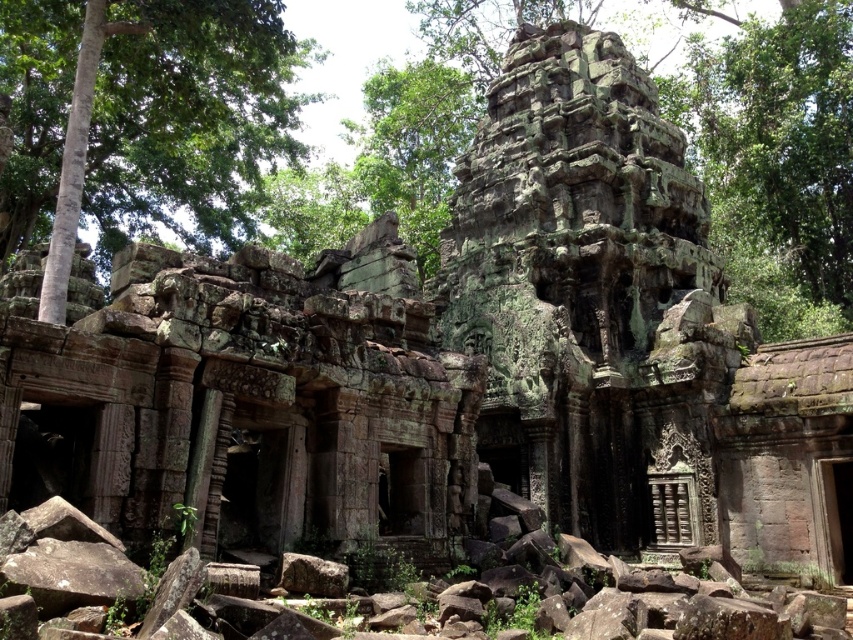
You are a tourist standing at the center of the ancient temple ruins. You notice a green mossy tree at upper left in the scene. Can you determine its exact location using coordinates?

The green mossy tree at upper left is located at point [144,113].

Consider the image. You are standing at the entrance of the ancient temple ruins. There is a point marked at coordinates point (776, 161). What does this point represent?

The point (776, 161) represents the green mossy stone temple at center.